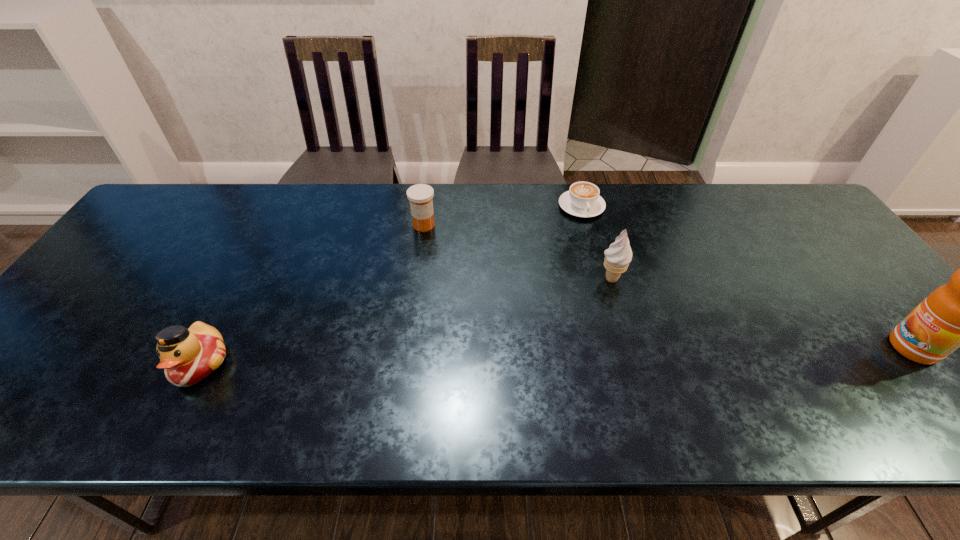
Identify the location of duck. Image resolution: width=960 pixels, height=540 pixels. (187, 356).

This screenshot has height=540, width=960. Identify the location of the tallest object. (958, 314).

Locate an element on the screen. This screenshot has height=540, width=960. fruit juice is located at coordinates (958, 314).

Find the location of a particular element. the third farthest object is located at coordinates (618, 256).

The image size is (960, 540). In order to click on icecream in this screenshot , I will do `click(618, 256)`.

Locate an element on the screen. The width and height of the screenshot is (960, 540). cappuccino is located at coordinates (583, 200).

Find the location of a particular element. The image size is (960, 540). the fourth object from right to left is located at coordinates (420, 195).

The height and width of the screenshot is (540, 960). Find the location of `vacant space located 0.130m on the label side of the rightmost object`. vacant space located 0.130m on the label side of the rightmost object is located at coordinates (834, 348).

Find the location of a particular element. The width and height of the screenshot is (960, 540). vacant region located 0.070m on the label side of the rightmost object is located at coordinates (861, 348).

This screenshot has width=960, height=540. Find the location of `free location located on the label side of the rightmost object`. free location located on the label side of the rightmost object is located at coordinates (796, 348).